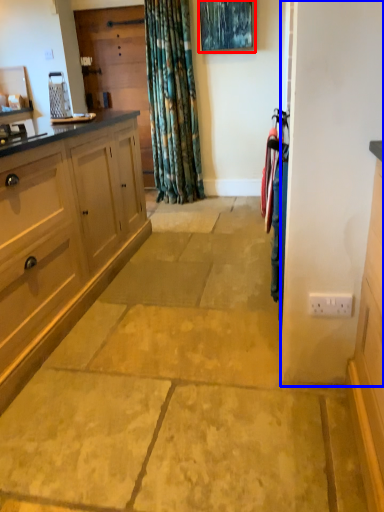
Question: Which object appears closest to the camera in this image, picture frame (highlighted by a red box) or screen door (highlighted by a blue box)?

Choices:
 (A) picture frame
 (B) screen door

Answer: (B)